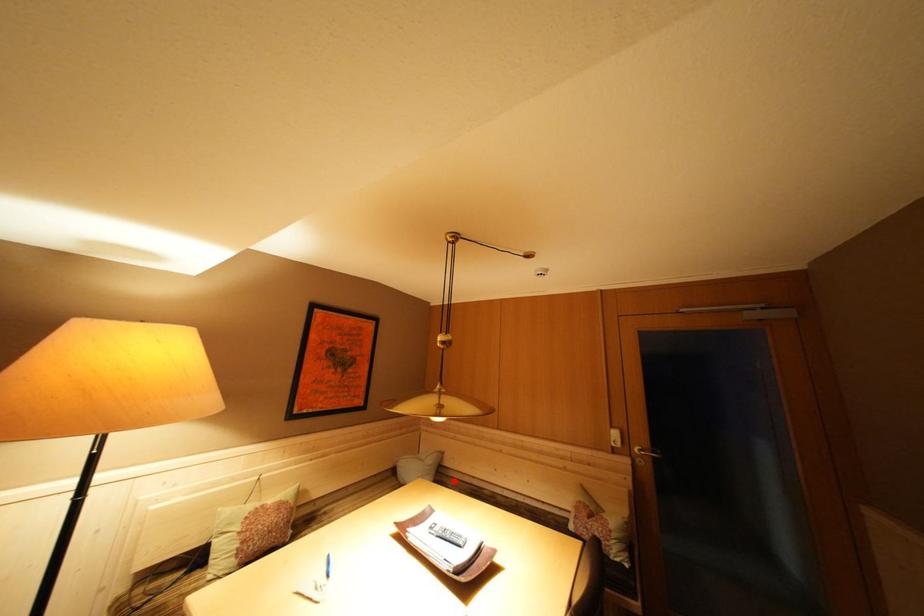
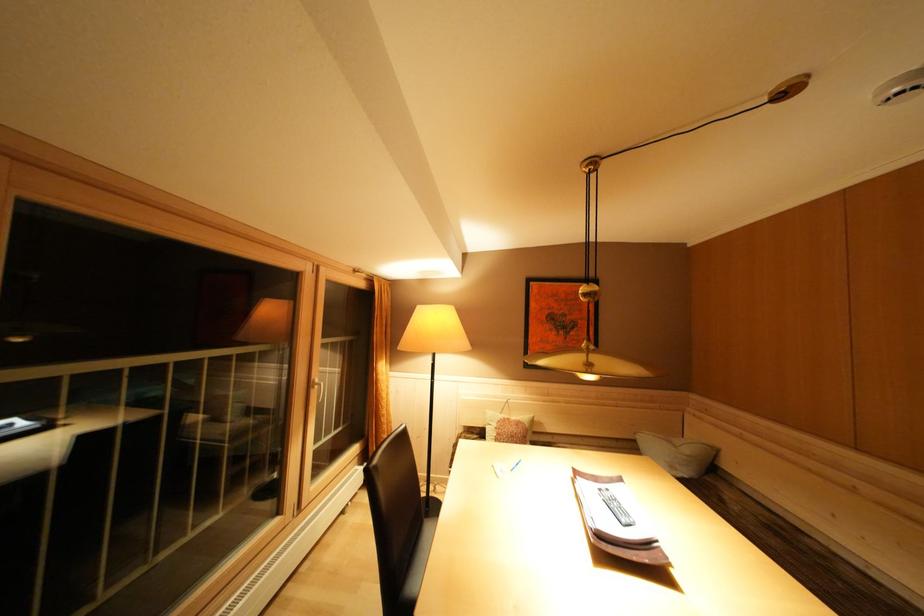
Locate, in the second image, the point that corresponds to the highlighted location in the first image.

(737, 490)